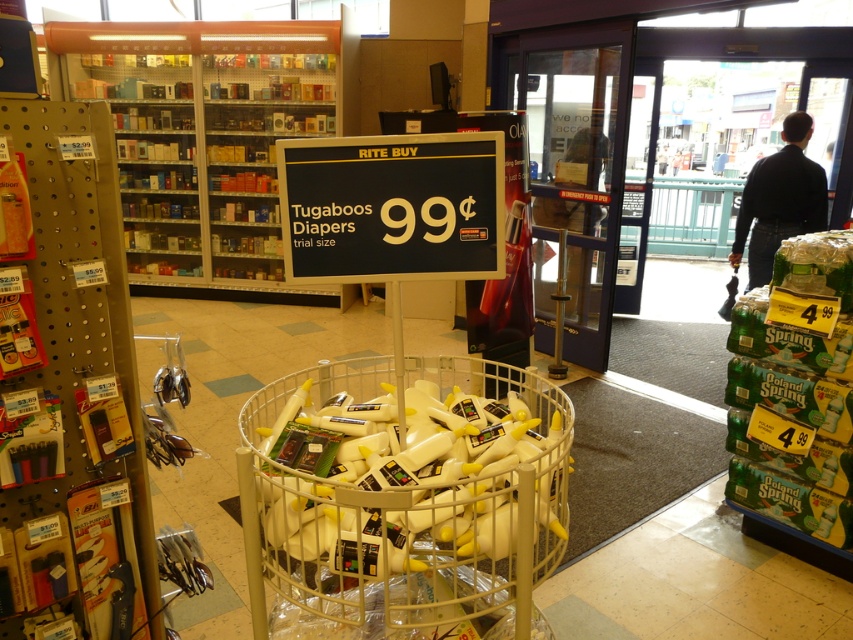
You are a customer in the store and want to reach the metallic silver shelves at upper left and the black plastic sign at center. Which object is closer to you?

The metallic silver shelves at upper left are closer to you since they are further to the viewer than the black plastic sign at center.